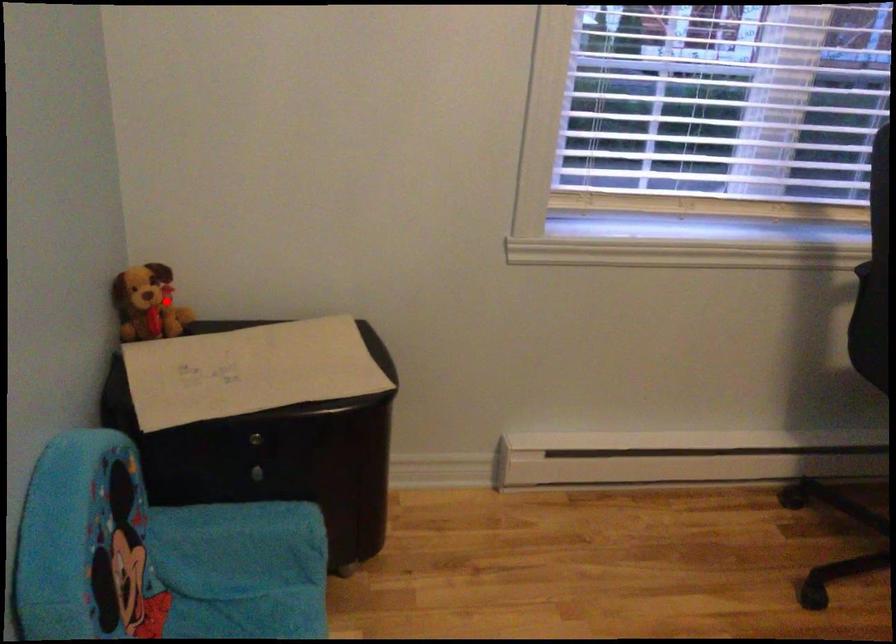
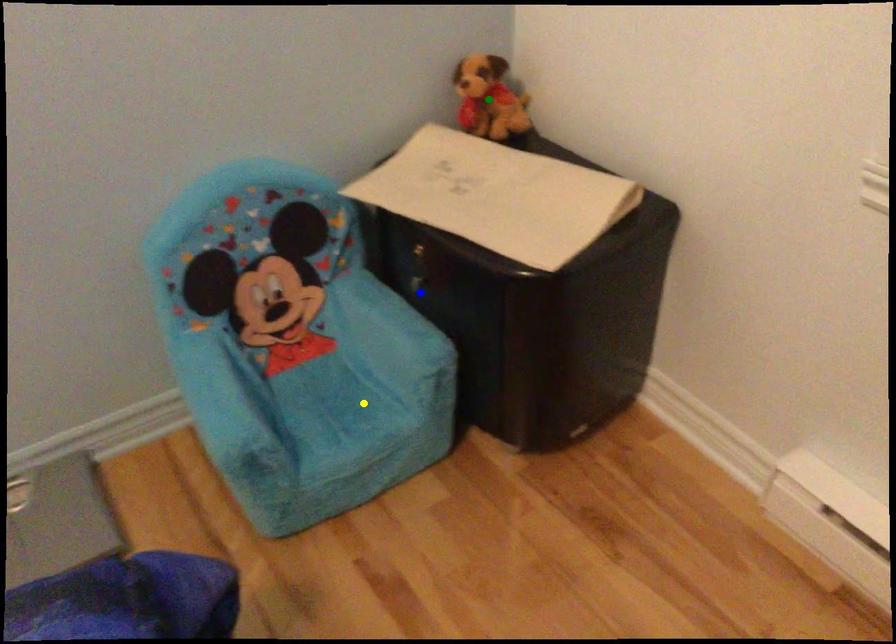
Question: I am providing you with two images of the same scene from different viewpoints. A red point is marked on the first image. You are given multiple points on the second image. In image 2, which mark is for the same physical point as the one in image 1?

Choices:
 (A) green point
 (B) yellow point
 (C) blue point

Answer: (A)